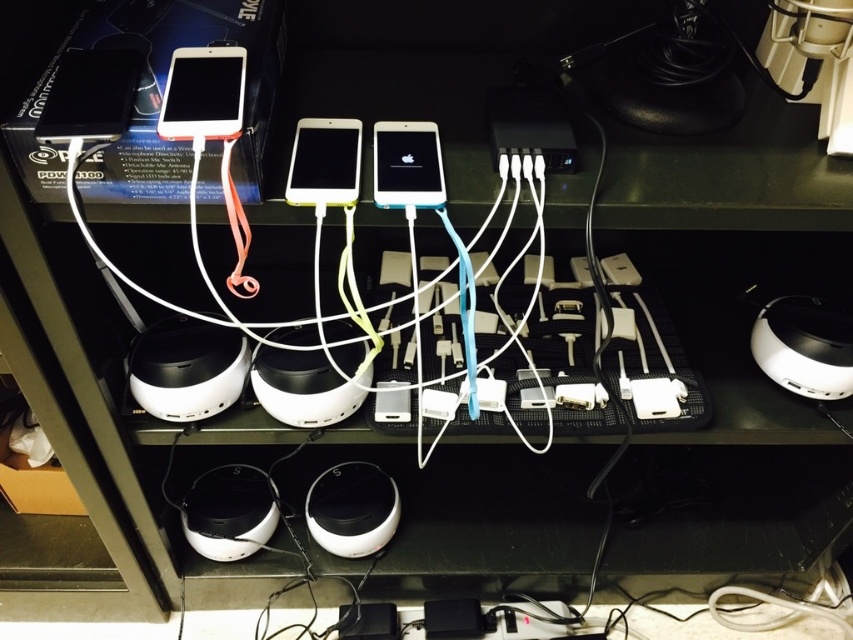
You are standing 20 inches away from a shelf holding several smartphones. There is a point at coordinates point (120, 113) on the shelf. Can you reach that point without moving closer to the shelf?

The distance of point (120, 113) from viewer is 22.62 inches, so you are currently 20 inches away from the shelf. Since the point is 22.62 inches away, you would need to move 2.62 inches closer to reach it without stretching. Therefore, you cannot reach the point without moving closer.

You are a technician trying to locate a specific point on the shelf. The point is at coordinates point (90, 96). Which object is this point located on?

The point (90, 96) is located on the matte black phone at upper left.

You are organizing the devices on the shelf and need to place a new charger between the white matte phone at center and the white glossy iphone at center. Based on their current positions, where should you place the charger?

The white matte phone at center is to the left of the white glossy iphone at center, so you should place the charger between them on the right side of the white matte phone at center and the left side of the white glossy iphone at center.